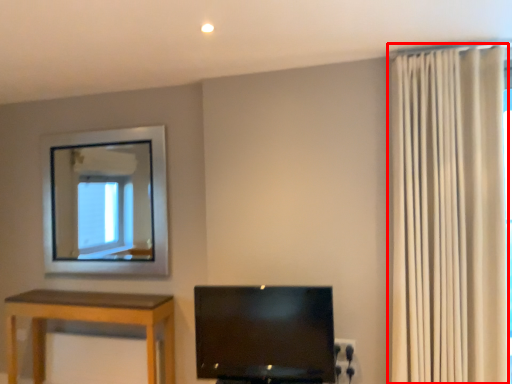
Question: From the image's perspective, considering the relative positions of curtain (annotated by the red box) and television in the image provided, where is curtain (annotated by the red box) located with respect to the staircase?

Choices:
 (A) below
 (B) above

Answer: (B)